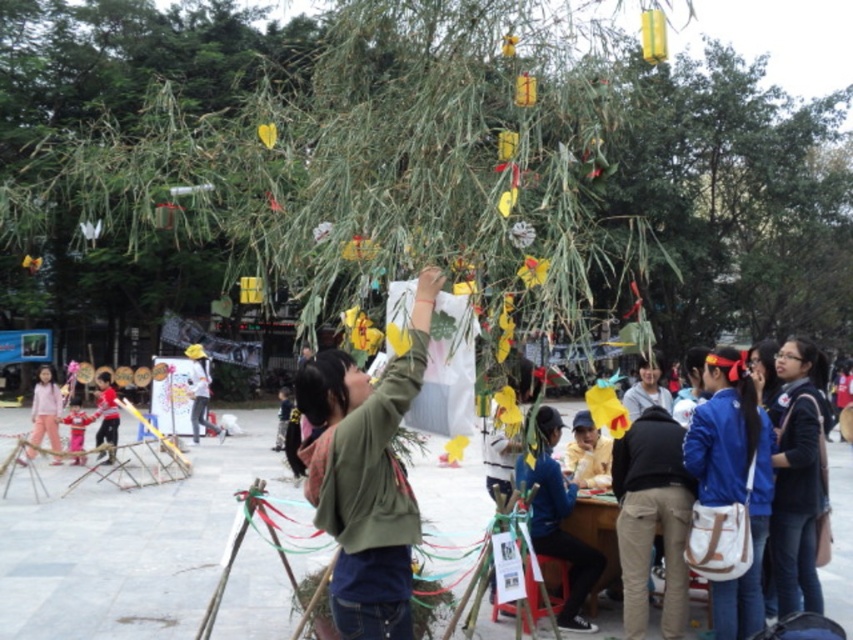
Question: Can you confirm if green bamboo tree at center is wider than red shirt at left?

Choices:
 (A) no
 (B) yes

Answer: (B)

Question: Which point appears farthest from the camera in this image?

Choices:
 (A) (605, 484)
 (B) (45, 371)
 (C) (68, 436)

Answer: (C)

Question: Is green matte jacket at center thinner than light blue fabric at center?

Choices:
 (A) no
 (B) yes

Answer: (A)

Question: Which point appears farthest from the camera in this image?

Choices:
 (A) (798, 397)
 (B) (134, 16)

Answer: (B)

Question: Observing the image, what is the correct spatial positioning of black cotton pants at lower right in reference to light blue shirt at center?

Choices:
 (A) right
 (B) left

Answer: (A)

Question: Based on their relative distances, which object is farther from the black fabric jacket at lower right?

Choices:
 (A) green bamboo tree at center
 (B) matte pink dress at lower left

Answer: (A)